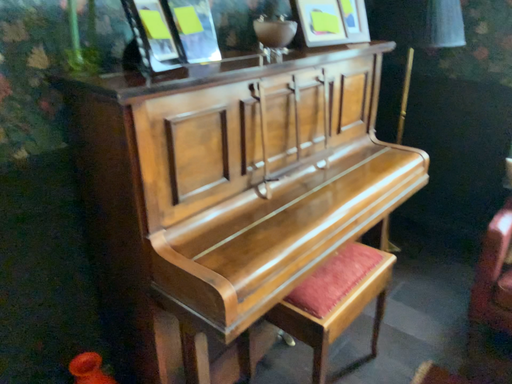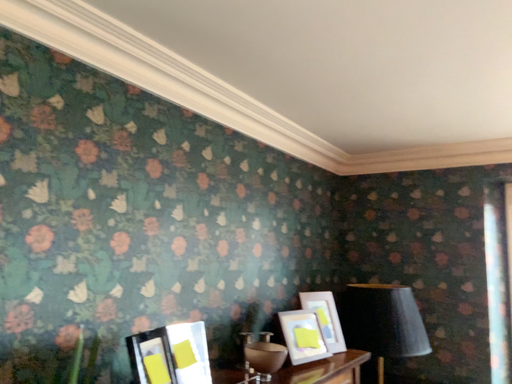
Question: How did the camera likely rotate when shooting the video?

Choices:
 (A) rotated upward
 (B) rotated downward

Answer: (A)